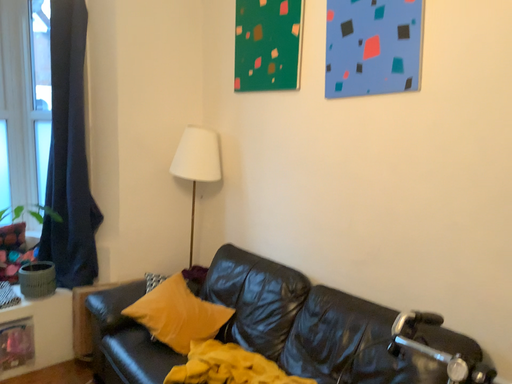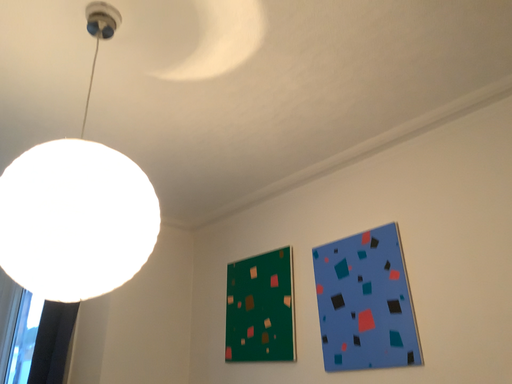
Question: How did the camera likely rotate when shooting the video?

Choices:
 (A) rotated downward
 (B) rotated upward

Answer: (B)